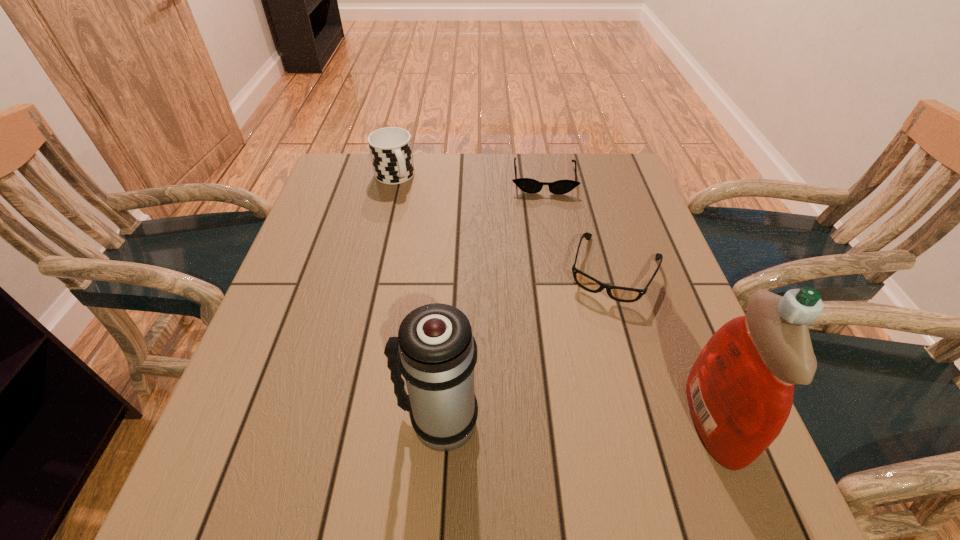
Identify the location of cup situated at the far edge. (390, 148).

Locate an element on the screen. This screenshot has height=540, width=960. thermos bottle that is positioned at the near edge is located at coordinates (435, 351).

Image resolution: width=960 pixels, height=540 pixels. In order to click on detergent at the near edge in this screenshot , I will do `click(740, 390)`.

At what (x,y) coordinates should I click in order to perform the action: click on object at the left edge. Please return your answer as a coordinate pair (x, y). Image resolution: width=960 pixels, height=540 pixels. Looking at the image, I should click on (390, 148).

Image resolution: width=960 pixels, height=540 pixels. I want to click on detergent that is at the right edge, so click(x=740, y=390).

At what (x,y) coordinates should I click in order to perform the action: click on spectacles that is at the right edge. Please return your answer as a coordinate pair (x, y). The image size is (960, 540). Looking at the image, I should click on tap(622, 294).

The height and width of the screenshot is (540, 960). What are the coordinates of `object at the far left corner` in the screenshot? It's located at click(390, 148).

Locate an element on the screen. object positioned at the near right corner is located at coordinates (740, 390).

You are a GUI agent. You are given a task and a screenshot of the screen. Output one action in this format:
    pyautogui.click(x=<x>, y=<y>)
    Task: Click on the vacant space at the far edge of the desktop
    This screenshot has height=540, width=960.
    Given the screenshot: What is the action you would take?
    pyautogui.click(x=508, y=167)

In the image, there is a desktop. Identify the location of vacant space at the near edge. [x=620, y=443].